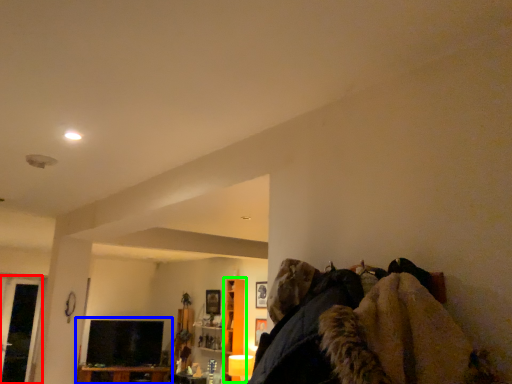
Question: Considering the real-world distances, which object is closest to glass door (highlighted by a red box)? entertainment center (highlighted by a blue box) or cabinet (highlighted by a green box).

Choices:
 (A) entertainment center
 (B) cabinet

Answer: (A)